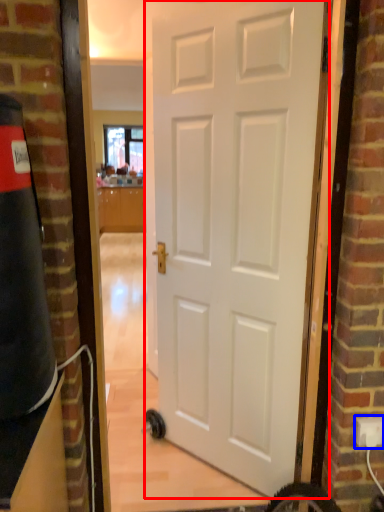
Question: Among these objects, which one is farthest to the camera, door (highlighted by a red box) or electric outlet (highlighted by a blue box)?

Choices:
 (A) door
 (B) electric outlet

Answer: (B)